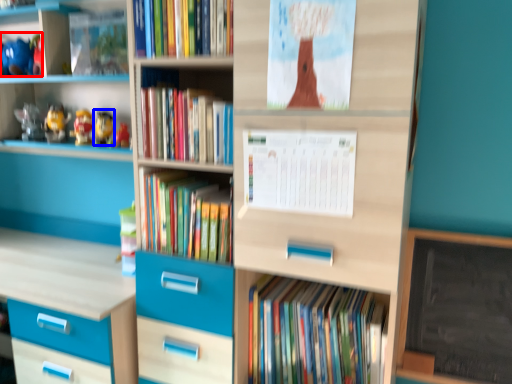
Question: Which object is closer to the camera taking this photo, toy (highlighted by a red box) or toy (highlighted by a blue box)?

Choices:
 (A) toy
 (B) toy

Answer: (B)